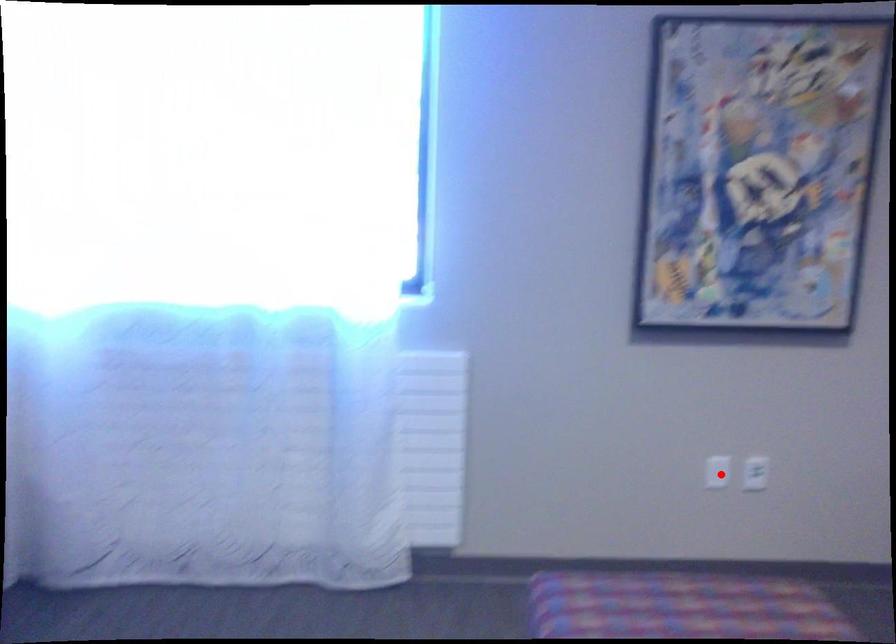
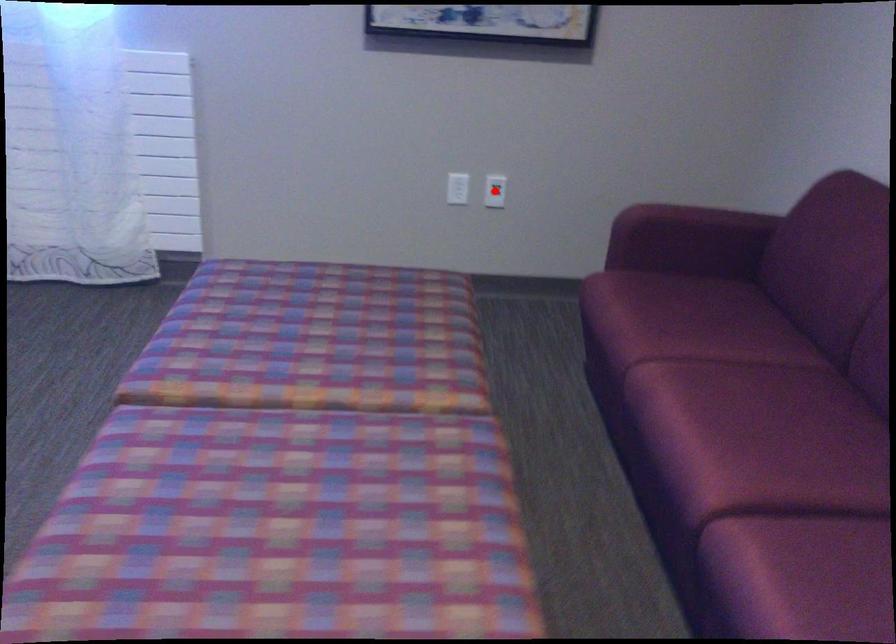
I am providing you with two images of the same scene from different viewpoints. A red point is marked on the first image and another point is marked on the second image. Do the highlighted points in image1 and image2 indicate the same real-world spot?

No